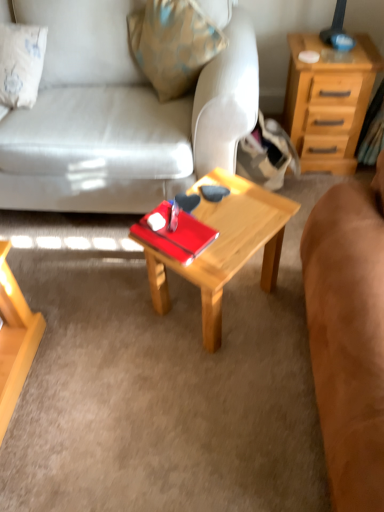
Image resolution: width=384 pixels, height=512 pixels. In order to click on free space in front of matte white couch at center, the second studio couch in the right-to-left sequence in this screenshot , I will do `click(124, 343)`.